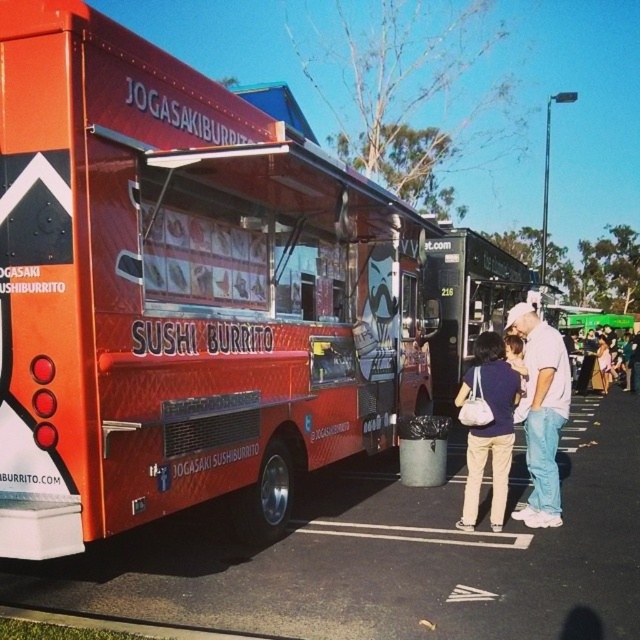
Is orange matte food truck at center to the right of white cotton shirt at right from the viewer's perspective?

No, orange matte food truck at center is not to the right of white cotton shirt at right.

Locate an element on the screen. orange matte food truck at center is located at coordinates (180, 292).

Does white cotton shirt at right have a greater height compared to white painted line at lower center?

Indeed, white cotton shirt at right has a greater height compared to white painted line at lower center.

Can you confirm if white cotton shirt at right is positioned below white painted line at lower center?

No, white cotton shirt at right is not below white painted line at lower center.

At what (x,y) coordinates should I click in order to perform the action: click on white cotton shirt at right. Please return your answer as a coordinate pair (x, y). This screenshot has height=640, width=640. Looking at the image, I should click on click(541, 412).

Is point (45, 4) positioned before point (605, 392)?

Yes, it is.

Does orange matte food truck at center appear on the left side of denim jacket at lower right?

Correct, you'll find orange matte food truck at center to the left of denim jacket at lower right.

Between point (192, 147) and point (611, 342), which one is positioned behind?

The point (611, 342) is more distant.

Locate an element on the screen. Image resolution: width=640 pixels, height=640 pixels. orange matte food truck at center is located at coordinates (180, 292).